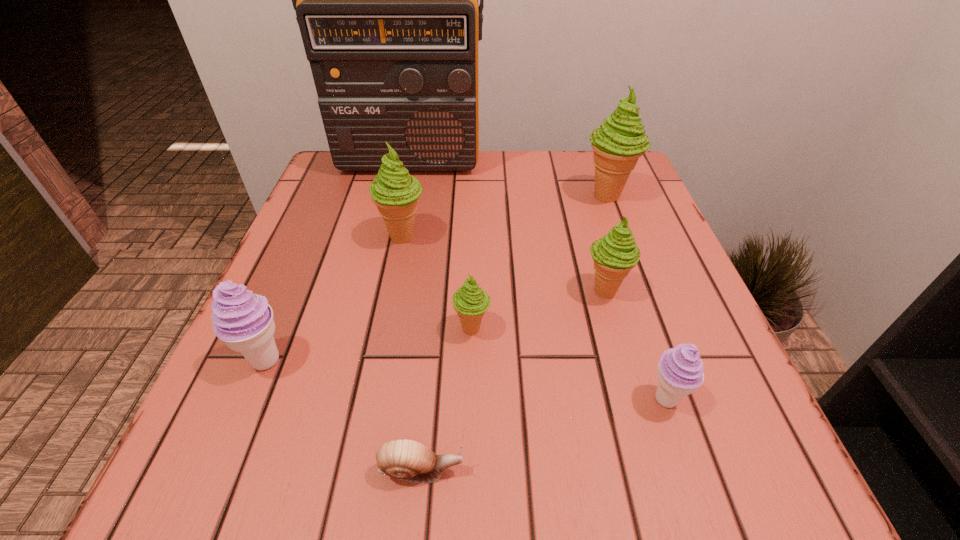
Where is `vacant space that's between the leftmost icecream and the third farthest green icecream`? Image resolution: width=960 pixels, height=540 pixels. vacant space that's between the leftmost icecream and the third farthest green icecream is located at coordinates click(x=435, y=325).

Find the location of a particular element. The height and width of the screenshot is (540, 960). vacant space that's between the second green icecream from left to right and the radio receiver is located at coordinates (440, 246).

Identify the location of unoccupied area between the farthest object and the fourth icecream from right to left. Image resolution: width=960 pixels, height=540 pixels. (440, 246).

Locate an element on the screen. This screenshot has height=540, width=960. vacant area that lies between the right purple icecream and the smallest green icecream is located at coordinates (568, 364).

This screenshot has width=960, height=540. In order to click on object that is the third closest one to the sixth shortest object in this screenshot , I will do `click(244, 321)`.

At what (x,y) coordinates should I click in order to perform the action: click on the second closest object to the farthest object. Please return your answer as a coordinate pair (x, y). This screenshot has width=960, height=540. Looking at the image, I should click on (618, 143).

Where is `icecream that stands as the third closest to the third biggest green icecream`? This screenshot has height=540, width=960. icecream that stands as the third closest to the third biggest green icecream is located at coordinates (618, 143).

Choose which icecream is the second nearest neighbor to the bigger purple icecream. Please provide its 2D coordinates. Your answer should be formatted as a tuple, i.e. [(x, y)], where the tuple contains the x and y coordinates of a point satisfying the conditions above.

[(470, 302)]

Locate an element on the screen. Image resolution: width=960 pixels, height=540 pixels. green icecream identified as the third closest to the tallest object is located at coordinates (614, 255).

This screenshot has width=960, height=540. I want to click on green icecream identified as the third closest to the leftmost icecream, so click(x=614, y=255).